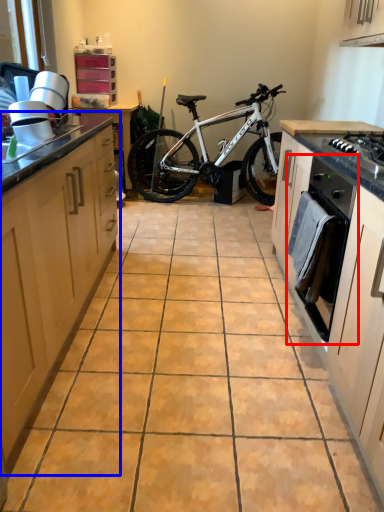
Question: Which of the following is the closest to the observer, oven (highlighted by a red box) or cabinetry (highlighted by a blue box)?

Choices:
 (A) oven
 (B) cabinetry

Answer: (B)